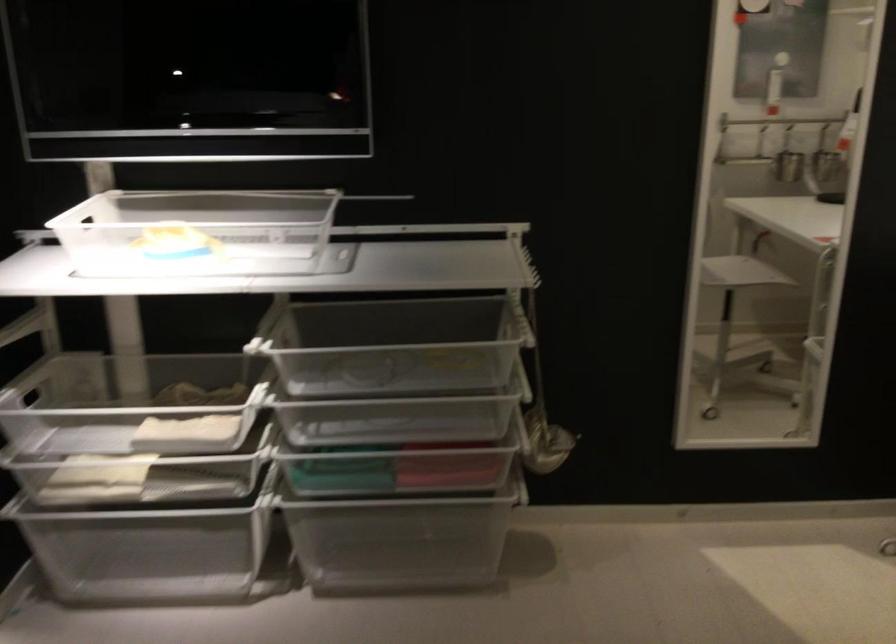
This screenshot has width=896, height=644. I want to click on white plastic basket, so click(197, 232).